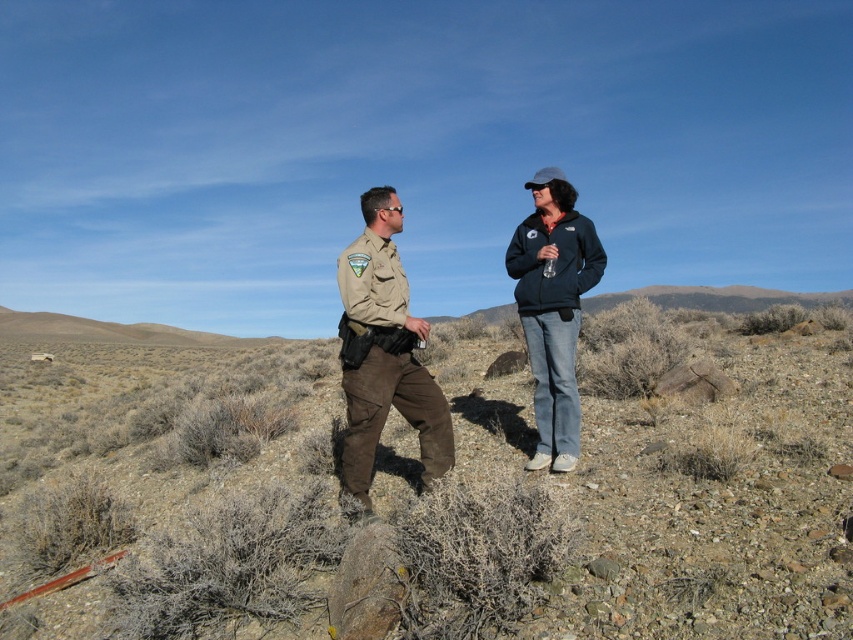
Is point (532, 515) less distant than point (369, 300)?

That is True.

Between brown dirt at center and tan uniform at center, which one has less height?

Standing shorter between the two is tan uniform at center.

Image resolution: width=853 pixels, height=640 pixels. I want to click on brown dirt at center, so click(x=637, y=493).

You are a GUI agent. You are given a task and a screenshot of the screen. Output one action in this format:
    pyautogui.click(x=<x>, y=<y>)
    Task: Click on the brown dirt at center
    The height and width of the screenshot is (640, 853).
    Given the screenshot: What is the action you would take?
    pyautogui.click(x=637, y=493)

Between tan uniform at center and dark blue fleece jacket at center, which one appears on the right side from the viewer's perspective?

dark blue fleece jacket at center

Based on the photo, how far apart are tan uniform at center and dark blue fleece jacket at center?

tan uniform at center and dark blue fleece jacket at center are 1.63 meters apart from each other.

Does point (401, 368) lie in front of point (515, 257)?

That is True.

Locate an element on the screen. This screenshot has width=853, height=640. tan uniform at center is located at coordinates pos(383,353).

Who is more distant from viewer, [352,580] or [584,275]?

The point [584,275] is more distant.

Which is in front, point (32, 376) or point (543, 232)?

Point (543, 232) is in front.

Where is `brown dirt at center`? This screenshot has height=640, width=853. brown dirt at center is located at coordinates (637, 493).